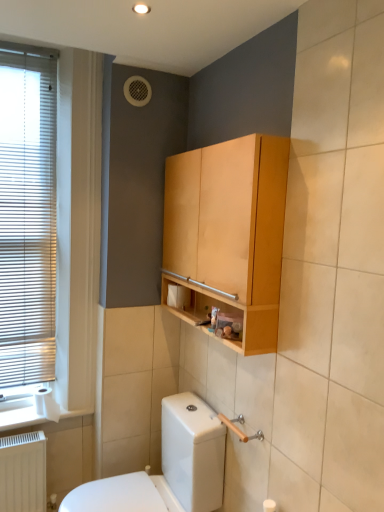
Question: Is white matte toilet paper at lower left, the second toilet paper in the top-to-bottom sequence, to the right of light brown wood cabinet at upper center from the viewer's perspective?

Choices:
 (A) yes
 (B) no

Answer: (B)

Question: Is white matte toilet paper at lower left, which ranks as the 1th toilet paper in bottom-to-top order, taller than light brown wood cabinet at upper center?

Choices:
 (A) yes
 (B) no

Answer: (B)

Question: Is white matte toilet paper at lower left, the second toilet paper in the top-to-bottom sequence, positioned with its back to light brown wood cabinet at upper center?

Choices:
 (A) no
 (B) yes

Answer: (A)

Question: Is white matte toilet paper at lower left, which ranks as the 1th toilet paper in bottom-to-top order, oriented towards light brown wood cabinet at upper center?

Choices:
 (A) yes
 (B) no

Answer: (B)

Question: From the image's perspective, is white matte toilet paper at lower left, which ranks as the 1th toilet paper in bottom-to-top order, over light brown wood cabinet at upper center?

Choices:
 (A) yes
 (B) no

Answer: (B)

Question: Considering the relative positions of white matte toilet paper at lower left, the second toilet paper in the top-to-bottom sequence, and white matte toilet paper at lower center, which is the second toilet paper from bottom to top, in the image provided, is white matte toilet paper at lower left, the second toilet paper in the top-to-bottom sequence, to the left or to the right of white matte toilet paper at lower center, which is the second toilet paper from bottom to top,?

Choices:
 (A) left
 (B) right

Answer: (A)

Question: Is white matte toilet paper at lower left, which ranks as the 1th toilet paper in bottom-to-top order, in front of or behind white matte toilet paper at lower center, which is the 1th toilet paper in top-to-bottom order, in the image?

Choices:
 (A) behind
 (B) front

Answer: (A)

Question: Is point (51, 404) closer or farther from the camera than point (175, 291)?

Choices:
 (A) closer
 (B) farther

Answer: (B)

Question: In terms of height, does white matte toilet paper at lower left, the 2th toilet paper from the right, look taller or shorter compared to white matte toilet paper at lower center, acting as the first toilet paper starting from the right?

Choices:
 (A) tall
 (B) short

Answer: (A)

Question: In terms of height, does light brown wood cabinet at upper center look taller or shorter compared to white matte toilet paper at lower center, acting as the first toilet paper starting from the right?

Choices:
 (A) tall
 (B) short

Answer: (A)

Question: Is point [259, 153] closer or farther from the camera than point [180, 289]?

Choices:
 (A) farther
 (B) closer

Answer: (B)

Question: Would you say light brown wood cabinet at upper center is to the left or to the right of white matte toilet paper at lower center, which is the second toilet paper from bottom to top, in the picture?

Choices:
 (A) right
 (B) left

Answer: (A)

Question: From a real-world perspective, relative to white matte toilet paper at lower center, acting as the first toilet paper starting from the right, is light brown wood cabinet at upper center vertically above or below?

Choices:
 (A) above
 (B) below

Answer: (A)

Question: In terms of height, does white glossy toilet at lower left look taller or shorter compared to white matte toilet paper at lower center, which is the second toilet paper from bottom to top?

Choices:
 (A) short
 (B) tall

Answer: (B)

Question: Which is correct: white glossy toilet at lower left is inside white matte toilet paper at lower center, acting as the first toilet paper starting from the right, or outside of it?

Choices:
 (A) inside
 (B) outside

Answer: (B)